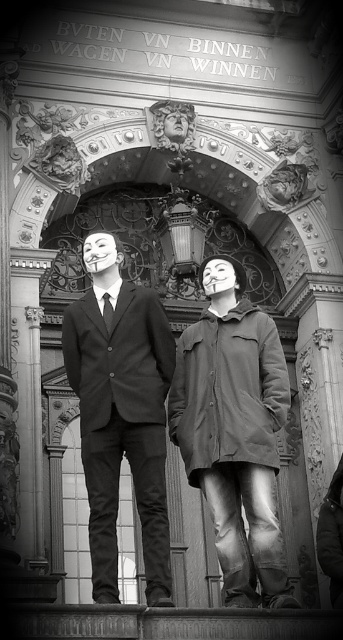
You are an art historian examining this historical photograph. You notice two figures wearing masks. One is wearing a matte black coat at center, and the other a matte black suit at center. Based on their positions, which one is standing closer to the archway?

The matte black coat at center is to the right of the matte black suit at center. Since they are both at the center, their proximity to the archway would depend on their lateral positioning. However, without depth cues, it is impossible to determine which is closer to the archway based solely on their left or right placement.

You are a fashion designer observing the two individuals in the image. You notice both are wearing matte black garments at the center. Which garment is positioned lower on their body between the matte black coat at center and the matte black suit at center?

The matte black coat at center is below the matte black suit at center, so the coat is positioned lower on their body.

You are a costume designer preparing for a play. You need to choose between the matte black coat at center and the matte black suit at center for a character who prefers smaller outfits. Which one should you select?

The matte black coat at center has a smaller size compared to the matte black suit at center, so it is the better choice for the character who prefers smaller outfits.